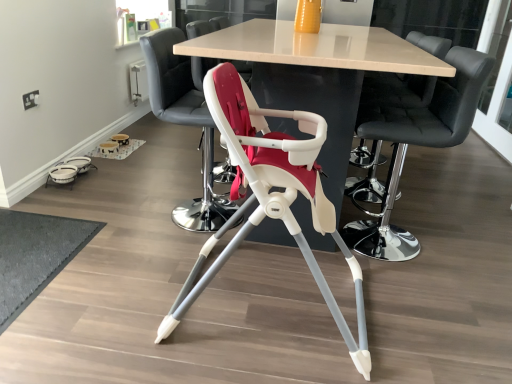
What are the coordinates of `vacant space that is in between matte white highchair at center, acting as the 3th chair starting from the right, and matte white table at center` in the screenshot? It's located at (314, 299).